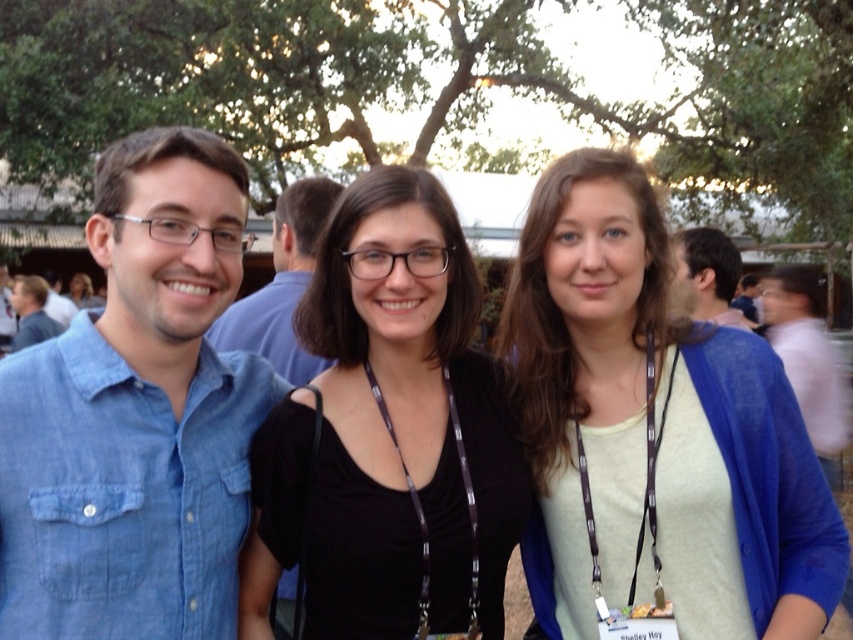
Question: Does pink fabric shirt at right appear on the right side of matte black lanyard at center?

Choices:
 (A) yes
 (B) no

Answer: (A)

Question: Which of the following is the farthest from the observer?

Choices:
 (A) (712, 234)
 (B) (129, 595)
 (C) (428, 202)
 (D) (840, 419)

Answer: (D)

Question: Can you confirm if pink fabric shirt at right is positioned below matte black lanyard at center?

Choices:
 (A) no
 (B) yes

Answer: (B)

Question: Considering the real-world distances, which object is farthest from the matte blue shirt at left?

Choices:
 (A) pink fabric shirt at right
 (B) light blue cardigan at center
 (C) black matte shirt at center

Answer: (B)

Question: Is the position of light blue cardigan at center less distant than that of matte black lanyard at center?

Choices:
 (A) no
 (B) yes

Answer: (B)

Question: Among these points, which one is nearest to the camera?

Choices:
 (A) (773, 284)
 (B) (42, 307)
 (C) (103, 305)
 (D) (363, 346)

Answer: (D)